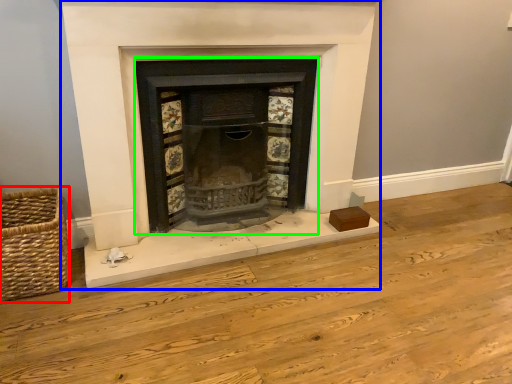
Question: Based on their relative distances, which object is farther from basket (highlighted by a red box)? Choose from fireplace (highlighted by a blue box) and wood burning stove (highlighted by a green box).

Choices:
 (A) fireplace
 (B) wood burning stove

Answer: (B)